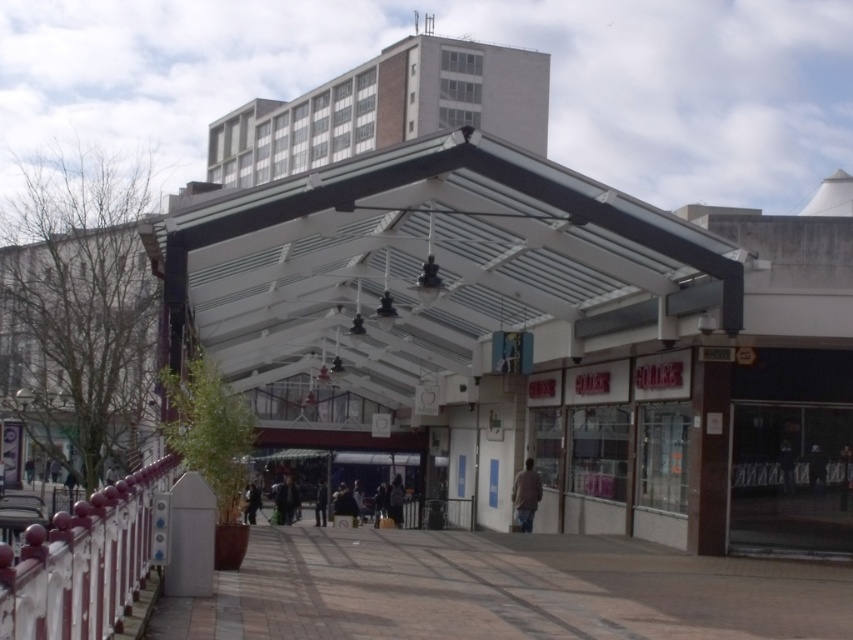
You are a pedestrian walking along the covered walkway and see the brown tile pavement at lower center and the dark gray jacket at center. Which object is located to the right of the other?

The brown tile pavement at lower center is positioned on the right side of dark gray jacket at center.

You are a delivery person carrying a large package and need to walk through the covered pedestrian walkway. The package is too heavy to lift, so you have to slide it along the ground. Which object, the brown tile pavement at lower center or the dark gray jacket at center, will the package first come into contact with?

The package will first come into contact with the brown tile pavement at lower center because it is larger than the dark gray jacket at center and is located at the lower part of the walkway.